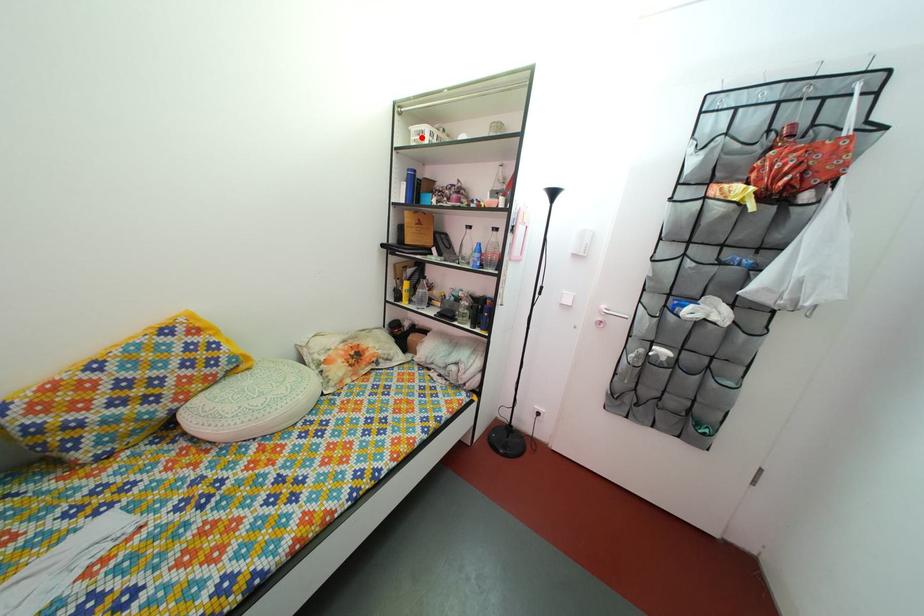
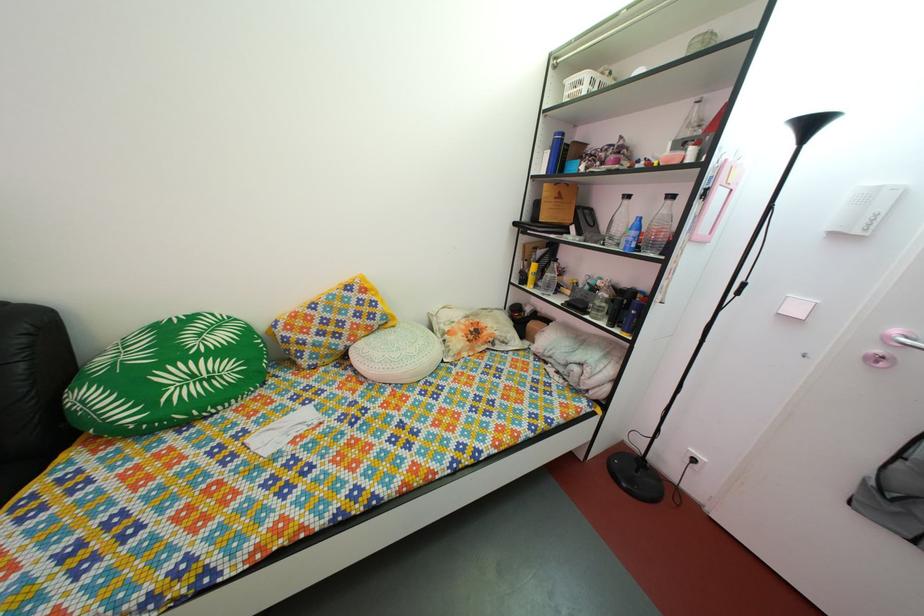
Where in the second image is the point corresponding to the highlighted location from the first image?

(578, 91)